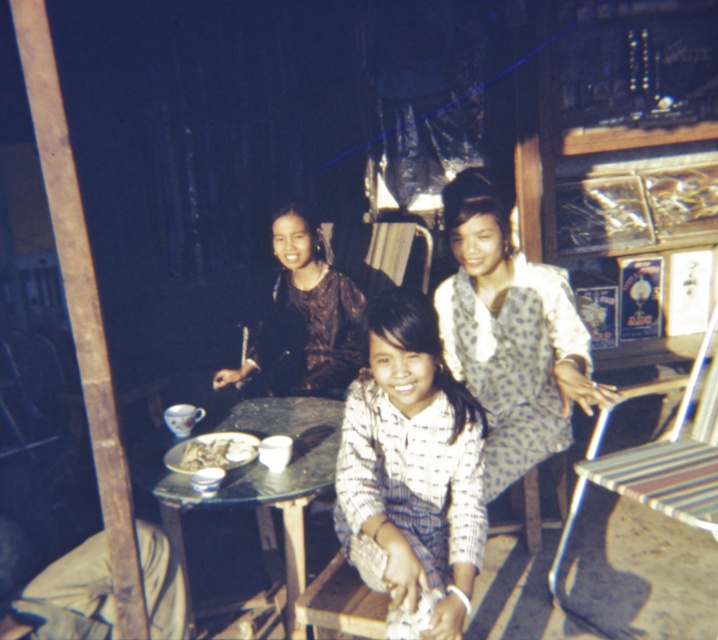
Question: Which of the following is the closest to the observer?

Choices:
 (A) checkered fabric shirt at center
 (B) wooden table at center
 (C) polka dot blouse at center
 (D) shiny brown blouse at center

Answer: (A)

Question: Among these objects, which one is nearest to the camera?

Choices:
 (A) metallic striped chair at right
 (B) white glossy plate at center
 (C) shiny brown blouse at center

Answer: (A)

Question: Does metallic striped chair at right have a smaller size compared to white glossy plate at center?

Choices:
 (A) yes
 (B) no

Answer: (B)

Question: In this image, where is wooden table at center located relative to shiny brown blouse at center?

Choices:
 (A) right
 (B) left

Answer: (B)

Question: Considering the relative positions of polka dot blouse at center and wooden table at center in the image provided, where is polka dot blouse at center located with respect to wooden table at center?

Choices:
 (A) above
 (B) below

Answer: (A)

Question: Which object appears closest to the camera in this image?

Choices:
 (A) checkered fabric shirt at center
 (B) shiny brown blouse at center

Answer: (A)